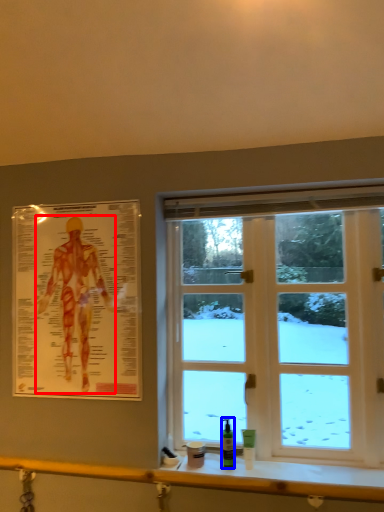
Question: Which of the following is the farthest to the observer, person (highlighted by a red box) or toiletry (highlighted by a blue box)?

Choices:
 (A) person
 (B) toiletry

Answer: (A)